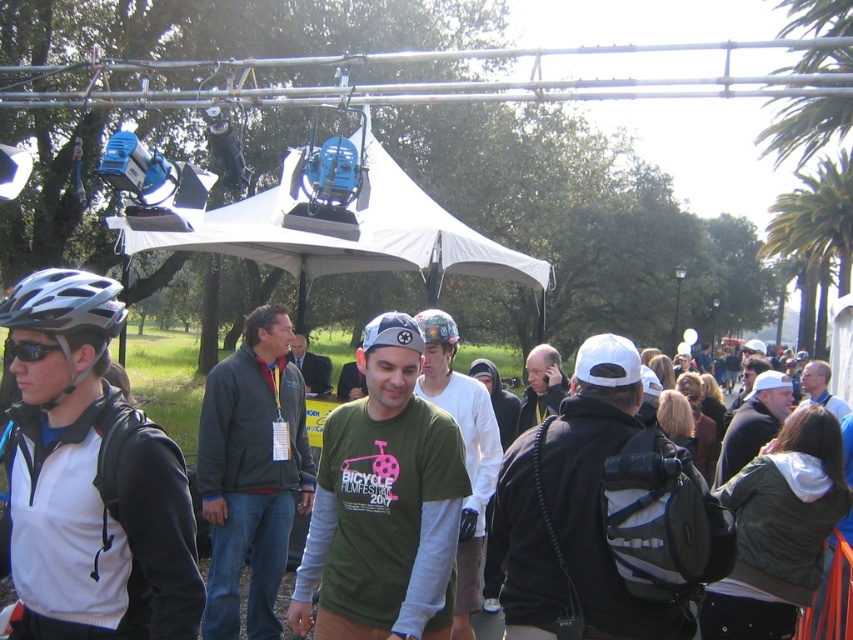
Question: Which of the following is the closest to the observer?

Choices:
 (A) (366, 614)
 (B) (791, 392)
 (C) (169, 452)
 (D) (560, 369)

Answer: (C)

Question: Does matte black helmet at left appear under dark green t-shirt at center?

Choices:
 (A) no
 (B) yes

Answer: (A)

Question: Is dark gray hoodie at center to the left of dark gray jacket at center from the viewer's perspective?

Choices:
 (A) yes
 (B) no

Answer: (B)

Question: Based on their relative distances, which object is farther from the dark blue jacket at center?

Choices:
 (A) matte black helmet at left
 (B) silver matte bicycle helmet at left
 (C) green matte shirt at center
 (D) silver metallic helmet at left

Answer: (D)

Question: Which object appears farthest from the camera in this image?

Choices:
 (A) dark green t-shirt at center
 (B) black matte sunglasses at left
 (C) matte black bicycle helmet at center
 (D) green cotton shirt at center

Answer: (C)

Question: Can you confirm if silver metallic helmet at left is wider than black matte sunglasses at left?

Choices:
 (A) no
 (B) yes

Answer: (A)